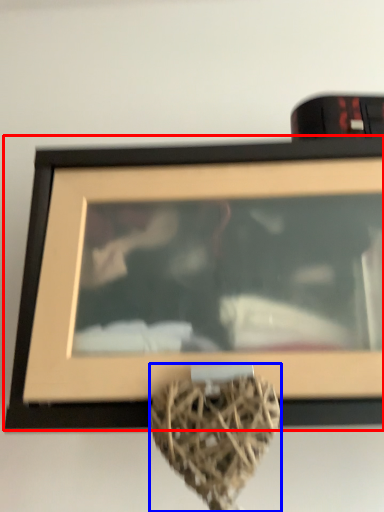
Question: Which object appears closest to the camera in this image, picture frame (highlighted by a red box) or vase (highlighted by a blue box)?

Choices:
 (A) picture frame
 (B) vase

Answer: (B)